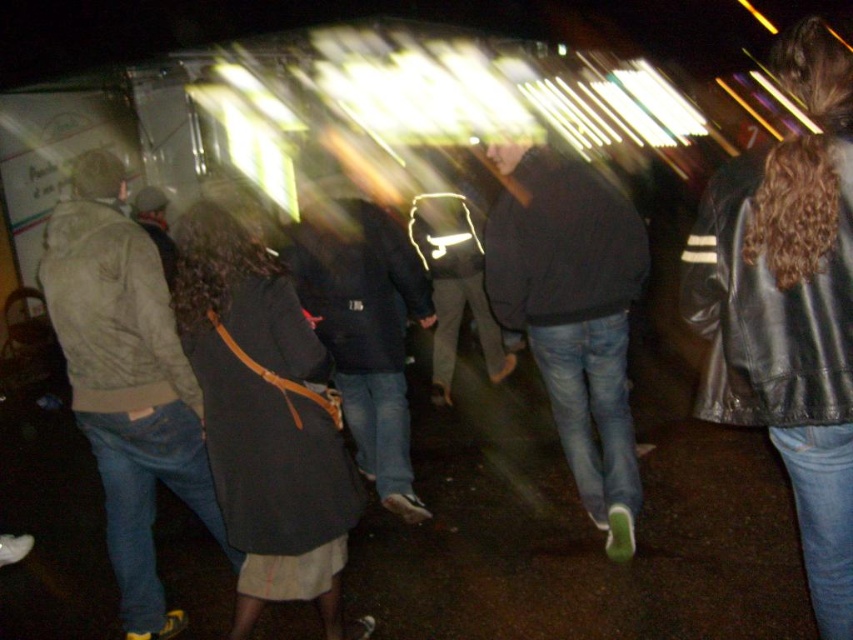
You are standing in the dimly lit space and want to locate the black leather jacket at right. According to the scene description, where would you expect to find it relative to the other people?

The black leather jacket at right is located at point 0.481 on the horizontal axis and 0.925 on the vertical axis, meaning it is positioned near the far right edge and lower part of the image.

You are a photographer trying to capture a clear image of the black leather jacket at right and the dark gray coat at center in this dimly lit scene. Which of the two garments is more likely to be captured with less blurring due to its size?

The black leather jacket at right is thinner than the dark gray coat at center, so the black leather jacket at right is more likely to be captured with less blurring because its smaller size requires less focus area.

You are standing in the dimly lit space where the group is moving. You notice a point marked at coordinates [788,307]. Which object from the scene does this point belong to?

The point at coordinates [788,307] is on the black leather jacket at right.